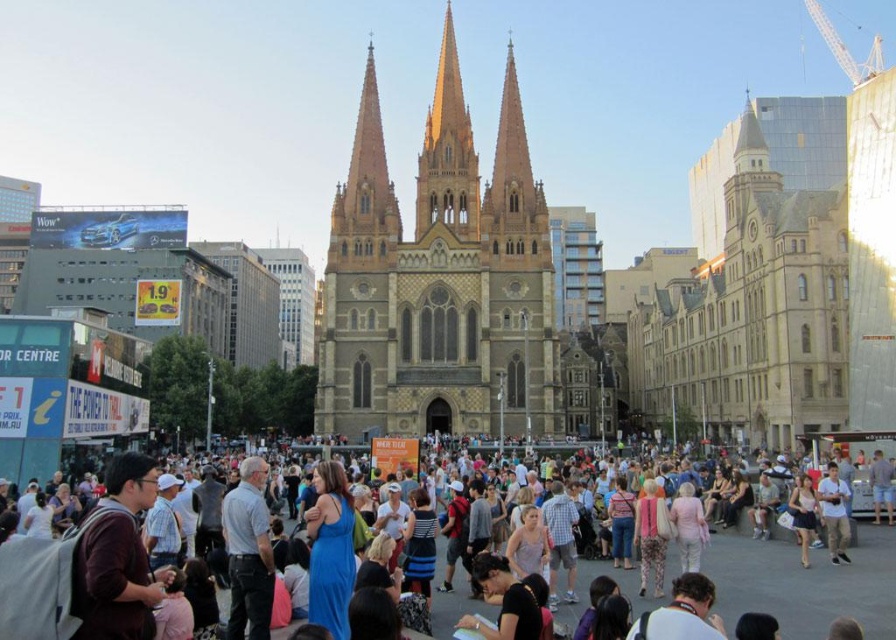
You are standing at the point labeled point (842, 534) and want to walk towards the cathedral. Is the point labeled point (368, 212) in your path?

Yes, the point labeled point (368, 212) is behind point (842, 534), so it is in your path towards the cathedral.

You are standing at the point with coordinates point (x=773, y=586) in the urban scene. You want to walk to the cathedral entrance. However, there is an obstacle at point (x=397, y=426). Can you walk directly towards the cathedral entrance without going around the obstacle?

Point (x=397, y=426) is behind point (x=773, y=586), so if you are at point (x=773, y=586) and want to go to the cathedral entrance, you would not encounter the obstacle at point (x=397, y=426) in your path. Therefore, you can walk directly towards the cathedral entrance without needing to go around.

You are a photographer standing at the edge of the crowd. You want to take a photo that includes both the multicolored casual attire at center and the light blue fabric shirt at center. How far apart are these two items in the scene?

The multicolored casual attire at center is 9.20 meters away from the light blue fabric shirt at center, so they are approximately 9.20 meters apart in the scene.